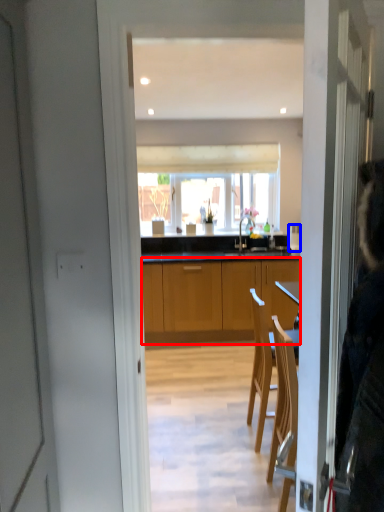
Question: Which point is closer to the camera, cabinetry (highlighted by a red box) or kitchen appliance (highlighted by a blue box)?

Choices:
 (A) cabinetry
 (B) kitchen appliance

Answer: (A)